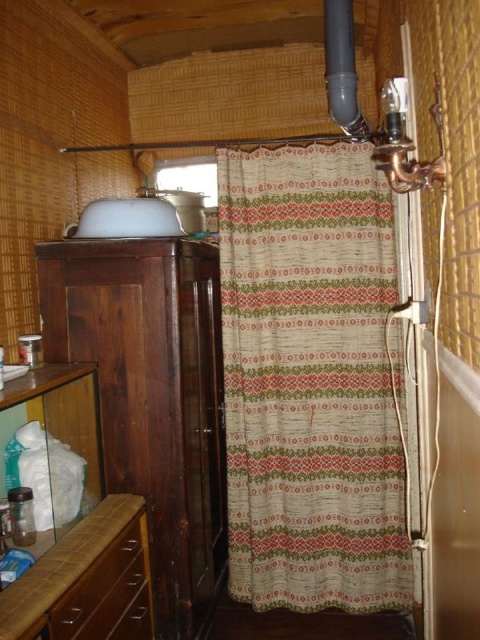
You are trying to hang a new shower curtain hook in this bathroom. The hook requires at least 1.2 meters of vertical space to install properly. Given the information about the patterned fabric shower curtain at center and the brown wood drawer at lower left, can you determine if there is enough space between them to install the hook?

The patterned fabric shower curtain at center has a greater height compared to the brown wood drawer at lower left. However, the exact vertical distance between them isn not specified. Without knowing the actual height difference or the total available space, it is impossible to determine if there is enough vertical space for the hook requiring 1.2 meters.

You are organizing items in the bathroom and need to know which object is wider. Which is wider, the patterned fabric shower curtain at center or the brown wood drawer at lower left?

The patterned fabric shower curtain at center is wider than the brown wood drawer at lower left.

You are standing in the bathroom and need to locate the patterned fabric shower curtain at center. According to the coordinates given, where would you find it?

The patterned fabric shower curtain at center is located at coordinates point (311,380).